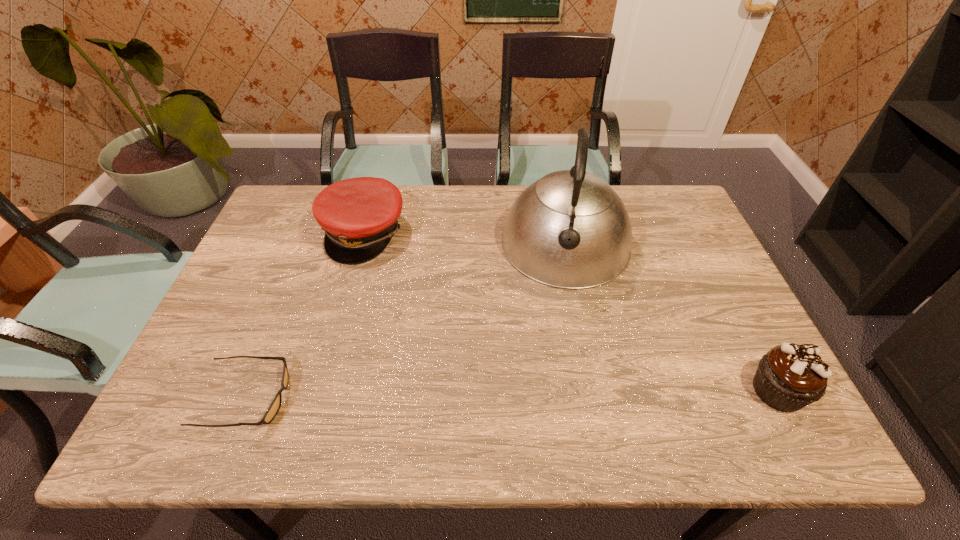
Identify the location of object at the near right corner. The width and height of the screenshot is (960, 540). (789, 377).

Identify the location of free space at the far edge. (633, 230).

Identify the location of vacant space at the near edge of the desktop. (315, 390).

In the image, there is a desktop. In order to click on vacant space at the left edge in this screenshot , I will do `click(247, 277)`.

This screenshot has width=960, height=540. In order to click on vacant area at the right edge in this screenshot , I will do `click(688, 291)`.

In the image, there is a desktop. Identify the location of vacant region at the near left corner. This screenshot has height=540, width=960. (236, 400).

The image size is (960, 540). What are the coordinates of `vacant space at the near right corner of the desktop` in the screenshot? It's located at point(725,393).

The height and width of the screenshot is (540, 960). What are the coordinates of `free space that is in between the shortest object and the cupcake` in the screenshot? It's located at (513, 394).

Find the location of a particular element. The image size is (960, 540). free space between the shortest object and the tallest object is located at coordinates (406, 321).

Identify the location of vacant space in between the cap and the kettle. The height and width of the screenshot is (540, 960). (465, 239).